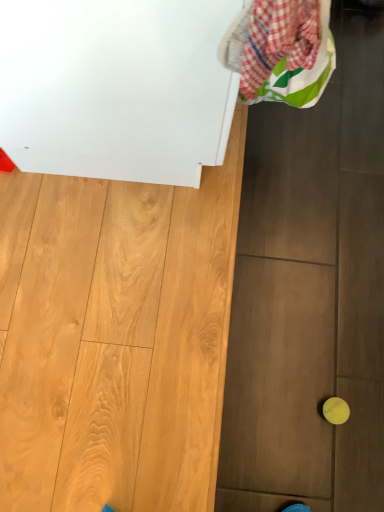
I want to click on plaid fabric laundry at upper right, so click(301, 73).

Is yellow rubber ball at lower right next to white glossy cabinet at upper left and touching it?

No, yellow rubber ball at lower right is not next to white glossy cabinet at upper left.

Considering the sizes of objects yellow rubber ball at lower right and white glossy cabinet at upper left in the image provided, who is smaller, yellow rubber ball at lower right or white glossy cabinet at upper left?

yellow rubber ball at lower right is smaller.

Which is in front, point (329, 405) or point (155, 10)?

Point (155, 10)

The image size is (384, 512). In order to click on appliance on the left of the yellow rubber ball at lower right in this screenshot , I will do `click(116, 87)`.

Would you say plaid fabric laundry at upper right is inside or outside white glossy cabinet at upper left?

plaid fabric laundry at upper right is spatially positioned inside white glossy cabinet at upper left.

Where is `laundry that is on the right side of white glossy cabinet at upper left`? laundry that is on the right side of white glossy cabinet at upper left is located at coordinates (301, 73).

Does white glossy cabinet at upper left turn towards yellow rubber ball at lower right?

No, white glossy cabinet at upper left is not aimed at yellow rubber ball at lower right.

Between white glossy cabinet at upper left and yellow rubber ball at lower right, which one has larger size?

Bigger between the two is white glossy cabinet at upper left.

Consider the image. From a real-world perspective, is white glossy cabinet at upper left on yellow rubber ball at lower right?

Yes.

Is point (232, 34) closer or farther from the camera than point (333, 405)?

Point (232, 34) appears to be closer to the viewer than point (333, 405).

Which object is further away from the camera taking this photo, plaid fabric laundry at upper right or yellow rubber ball at lower right?

yellow rubber ball at lower right is more distant.

How different are the orientations of plaid fabric laundry at upper right and yellow rubber ball at lower right in degrees?

The angular difference between plaid fabric laundry at upper right and yellow rubber ball at lower right is 0.868 degrees.

Based on the photo, are plaid fabric laundry at upper right and yellow rubber ball at lower right located far from each other?

No, plaid fabric laundry at upper right is in close proximity to yellow rubber ball at lower right.

From the image's perspective, is white glossy cabinet at upper left located beneath plaid fabric laundry at upper right?

No.

Between point (106, 161) and point (322, 79), which one is positioned behind?

The point (106, 161) is farther.

Is white glossy cabinet at upper left positioned behind plaid fabric laundry at upper right?

Yes, white glossy cabinet at upper left is further from the camera.

Can you confirm if yellow rubber ball at lower right is wider than plaid fabric laundry at upper right?

No, yellow rubber ball at lower right is not wider than plaid fabric laundry at upper right.

From a real-world perspective, does yellow rubber ball at lower right sit lower than plaid fabric laundry at upper right?

Yes, from a real-world perspective, yellow rubber ball at lower right is under plaid fabric laundry at upper right.

Who is bigger, yellow rubber ball at lower right or plaid fabric laundry at upper right?

plaid fabric laundry at upper right.

Between yellow rubber ball at lower right and plaid fabric laundry at upper right, which one is positioned in front?

plaid fabric laundry at upper right is more forward.

At what (x,y) coordinates should I click in order to perform the action: click on appliance located above the yellow rubber ball at lower right (from a real-world perspective). Please return your answer as a coordinate pair (x, y). The image size is (384, 512). Looking at the image, I should click on (116, 87).

Locate an element on the screen. The height and width of the screenshot is (512, 384). appliance beneath the plaid fabric laundry at upper right (from a real-world perspective) is located at coordinates (116, 87).

When comparing their distances from plaid fabric laundry at upper right, does white glossy cabinet at upper left or yellow rubber ball at lower right seem further?

The object further to plaid fabric laundry at upper right is yellow rubber ball at lower right.

Which object lies nearer to the anchor point white glossy cabinet at upper left, yellow rubber ball at lower right or plaid fabric laundry at upper right?

plaid fabric laundry at upper right.

Which object lies nearer to the anchor point yellow rubber ball at lower right, plaid fabric laundry at upper right or white glossy cabinet at upper left?

Among the two, plaid fabric laundry at upper right is located nearer to yellow rubber ball at lower right.

Estimate the real-world distances between objects in this image. Which object is further from yellow rubber ball at lower right, white glossy cabinet at upper left or plaid fabric laundry at upper right?

Among the two, white glossy cabinet at upper left is located further to yellow rubber ball at lower right.

Based on their spatial positions, is plaid fabric laundry at upper right or yellow rubber ball at lower right closer to white glossy cabinet at upper left?

plaid fabric laundry at upper right lies closer to white glossy cabinet at upper left than the other object.

Looking at the image, which one is located further to plaid fabric laundry at upper right, yellow rubber ball at lower right or white glossy cabinet at upper left?

yellow rubber ball at lower right is positioned further to the anchor plaid fabric laundry at upper right.

At what (x,y) coordinates should I click in order to perform the action: click on laundry between white glossy cabinet at upper left and yellow rubber ball at lower right in the up-down direction. Please return your answer as a coordinate pair (x, y). This screenshot has width=384, height=512. Looking at the image, I should click on (301, 73).